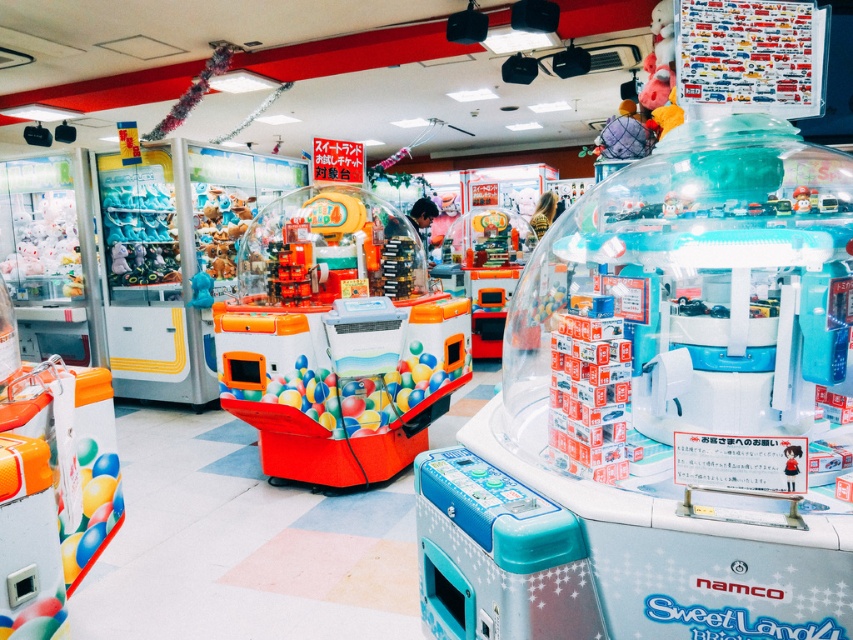
Question: Can you confirm if orange glossy claw machine at center is smaller than orange matte toy at center?

Choices:
 (A) no
 (B) yes

Answer: (A)

Question: Considering the relative positions of orange glossy claw machine at center and orange matte toy at center in the image provided, where is orange glossy claw machine at center located with respect to orange matte toy at center?

Choices:
 (A) above
 (B) below

Answer: (A)

Question: Can you confirm if orange glossy claw machine at center is wider than orange matte toy at center?

Choices:
 (A) no
 (B) yes

Answer: (B)

Question: Which object is closer to the camera taking this photo?

Choices:
 (A) orange glossy claw machine at center
 (B) orange matte toy at center

Answer: (B)

Question: Which of the following is the farthest from the observer?

Choices:
 (A) orange glossy claw machine at center
 (B) orange matte toy at center

Answer: (A)